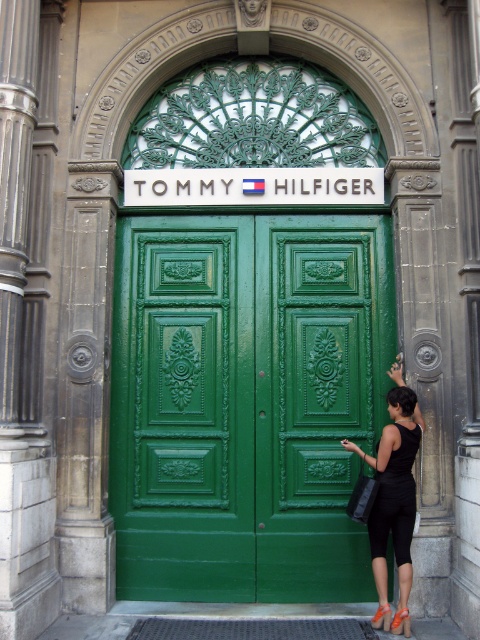
Who is shorter, green polished wood door at center or dark gray stone column at center?

dark gray stone column at center

Between point (276, 403) and point (11, 68), which one is positioned in front?

Point (11, 68) is in front.

Between point (291, 280) and point (45, 440), which one is positioned behind?

The point (291, 280) is more distant.

In order to click on green polished wood door at center in this screenshot , I will do `click(245, 403)`.

Looking at this image, is dark gray stone column at center thinner than black fabric dress at lower right?

Correct, dark gray stone column at center's width is less than black fabric dress at lower right's.

Image resolution: width=480 pixels, height=640 pixels. Identify the location of dark gray stone column at center. (25, 316).

Locate an element on the screen. dark gray stone column at center is located at coordinates (25, 316).

Where is `dark gray stone column at center`? dark gray stone column at center is located at coordinates (25, 316).

Measure the distance between green polished wood door at center and camera.

green polished wood door at center is 7.65 meters away from camera.

Where is `green polished wood door at center`? green polished wood door at center is located at coordinates (245, 403).

At what (x,y) coordinates should I click in order to perform the action: click on green polished wood door at center. Please return your answer as a coordinate pair (x, y). The width and height of the screenshot is (480, 640). Looking at the image, I should click on (245, 403).